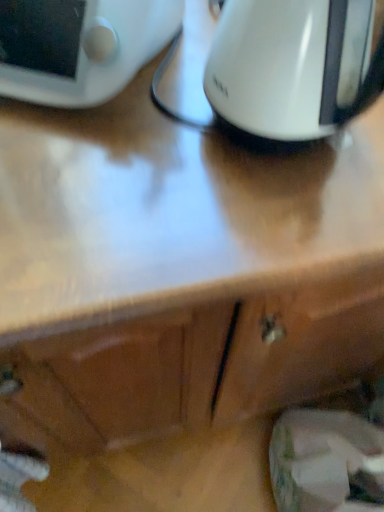
The image size is (384, 512). I want to click on free point in front of white glossy kettle at upper center, so click(x=263, y=227).